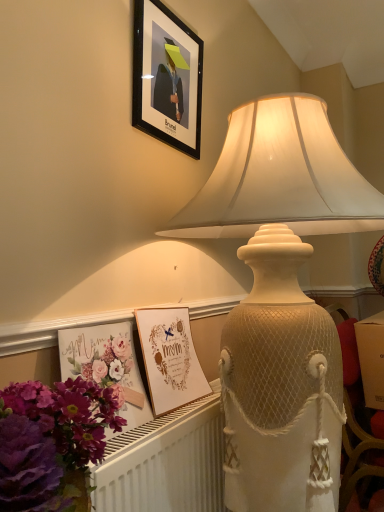
Question: Should I look upward or downward to see floral paper postcard at lower left, which ranks as the 1th postcard in front-to-back order?

Choices:
 (A) up
 (B) down

Answer: (B)

Question: Can you confirm if purple floral bouquet at lower left is positioned to the left of white textured radiator at lower left?

Choices:
 (A) yes
 (B) no

Answer: (A)

Question: Is purple floral bouquet at lower left next to white textured radiator at lower left?

Choices:
 (A) no
 (B) yes

Answer: (A)

Question: From the image's perspective, is purple floral bouquet at lower left located above white textured radiator at lower left?

Choices:
 (A) yes
 (B) no

Answer: (A)

Question: Is purple floral bouquet at lower left outside white textured radiator at lower left?

Choices:
 (A) no
 (B) yes

Answer: (B)

Question: Is purple floral bouquet at lower left to the right of white textured radiator at lower left from the viewer's perspective?

Choices:
 (A) no
 (B) yes

Answer: (A)

Question: Is the depth of purple floral bouquet at lower left less than that of white textured radiator at lower left?

Choices:
 (A) no
 (B) yes

Answer: (B)

Question: Is floral paper postcard at lower left, which ranks as the 1th postcard in front-to-back order, not near matte cream lampshade at upper center?

Choices:
 (A) no
 (B) yes

Answer: (A)

Question: Does floral paper postcard at lower left, which ranks as the 1th postcard in front-to-back order, have a lesser height compared to matte cream lampshade at upper center?

Choices:
 (A) yes
 (B) no

Answer: (A)

Question: Can you confirm if floral paper postcard at lower left, placed as the 2th postcard when sorted from back to front, is thinner than matte cream lampshade at upper center?

Choices:
 (A) no
 (B) yes

Answer: (B)

Question: Considering the relative sizes of floral paper postcard at lower left, placed as the 2th postcard when sorted from back to front, and matte cream lampshade at upper center in the image provided, is floral paper postcard at lower left, placed as the 2th postcard when sorted from back to front, smaller than matte cream lampshade at upper center?

Choices:
 (A) yes
 (B) no

Answer: (A)

Question: Does floral paper postcard at lower left, which ranks as the 1th postcard in front-to-back order, have a larger size compared to matte cream lampshade at upper center?

Choices:
 (A) no
 (B) yes

Answer: (A)

Question: From the image's perspective, is floral paper postcard at lower left, which ranks as the 1th postcard in front-to-back order, under matte cream lampshade at upper center?

Choices:
 (A) yes
 (B) no

Answer: (A)

Question: Is matte cream lampshade at upper center shorter than white textured radiator at lower left?

Choices:
 (A) yes
 (B) no

Answer: (B)